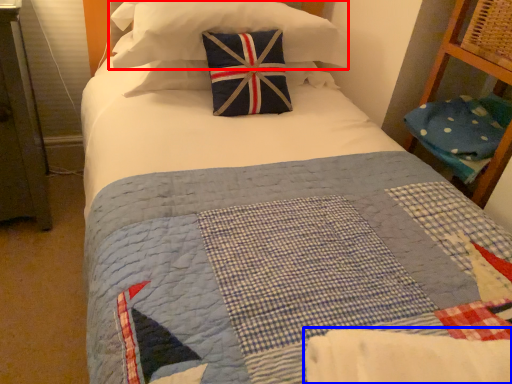
Question: Among these objects, which one is farthest to the camera, pillow (highlighted by a red box) or blanket (highlighted by a blue box)?

Choices:
 (A) pillow
 (B) blanket

Answer: (A)